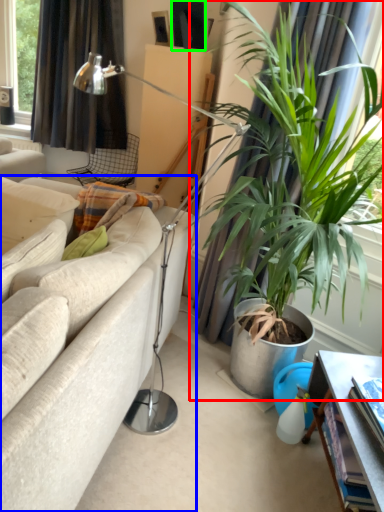
Question: Considering the real-world distances, which object is farthest from houseplant (highlighted by a red box)? studio couch (highlighted by a blue box) or picture frame (highlighted by a green box)?

Choices:
 (A) studio couch
 (B) picture frame

Answer: (B)